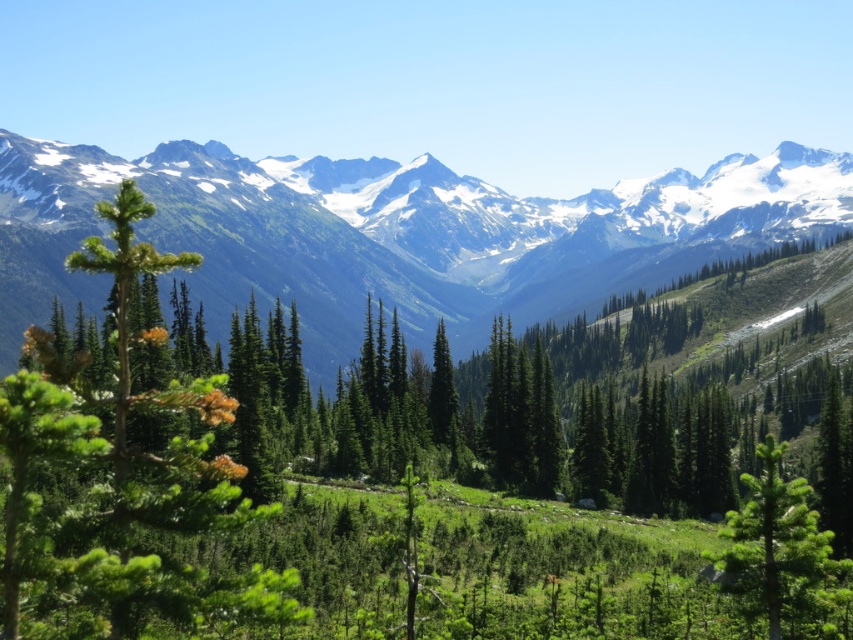
Who is positioned more to the left, green textured pine tree at center or green needle-like tree at left?

green needle-like tree at left is more to the left.

Identify the location of green textured pine tree at center. (398, 468).

Find the location of a particular element. The height and width of the screenshot is (640, 853). green textured pine tree at center is located at coordinates (398, 468).

Does green textured pine tree at center have a lesser height compared to green needle-like tree at center-right?

Incorrect, green textured pine tree at center's height does not fall short of green needle-like tree at center-right's.

I want to click on green textured pine tree at center, so click(398, 468).

Can you confirm if green needle-like tree at left is smaller than green needle-like tree at center-right?

Actually, green needle-like tree at left might be larger than green needle-like tree at center-right.

Who is positioned more to the right, green needle-like tree at left or green needle-like tree at center-right?

green needle-like tree at center-right is more to the right.

Between point (209, 602) and point (792, 572), which one is positioned behind?

Positioned behind is point (792, 572).

At what (x,y) coordinates should I click in order to perform the action: click on green needle-like tree at left. Please return your answer as a coordinate pair (x, y). This screenshot has width=853, height=640. Looking at the image, I should click on (128, 460).